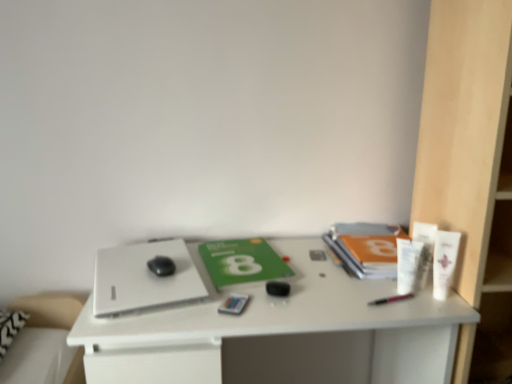
Find the location of `vacant area that lies between green matte paperback book at center, the second paperback book in the right-to-left sequence, and white matte tube at upper right, the 1th toiletry in the right-to-left sequence`. vacant area that lies between green matte paperback book at center, the second paperback book in the right-to-left sequence, and white matte tube at upper right, the 1th toiletry in the right-to-left sequence is located at coordinates 332,280.